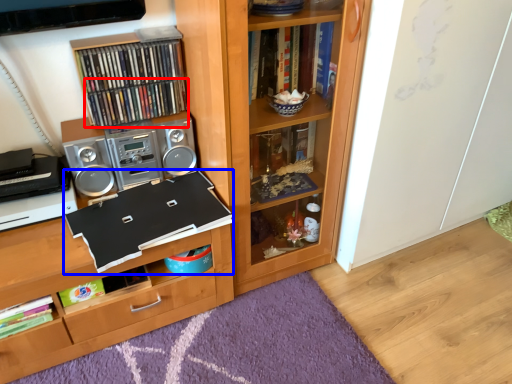
Question: Which of the following is the closest to the observer, book (highlighted by a red box) or book (highlighted by a blue box)?

Choices:
 (A) book
 (B) book

Answer: (B)